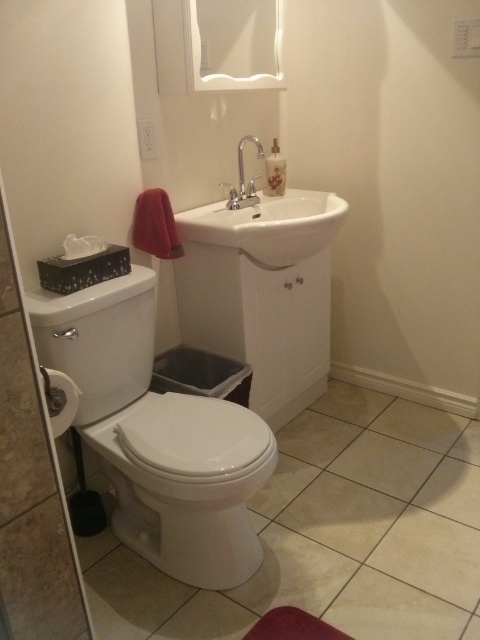
Question: Can you confirm if white glossy toilet at lower left is wider than silver metallic faucet at upper center?

Choices:
 (A) yes
 (B) no

Answer: (A)

Question: Does white glossy toilet bowl at lower left appear over white glossy tissue box at left?

Choices:
 (A) yes
 (B) no

Answer: (B)

Question: Is white glossy toilet at lower left to the left of white glossy sink at center from the viewer's perspective?

Choices:
 (A) no
 (B) yes

Answer: (B)

Question: Among these objects, which one is farthest from the camera?

Choices:
 (A) white glossy tissue box at left
 (B) white glossy sink at center
 (C) white glossy toilet at lower left

Answer: (B)

Question: Which point is farther to the camera?

Choices:
 (A) white glossy sink at center
 (B) white glossy tissue box at left

Answer: (A)

Question: Which of these objects is positioned farthest from the white glossy toilet at lower left?

Choices:
 (A) white glossy tissue box at left
 (B) silver metallic faucet at upper center
 (C) white glossy sink at center

Answer: (B)